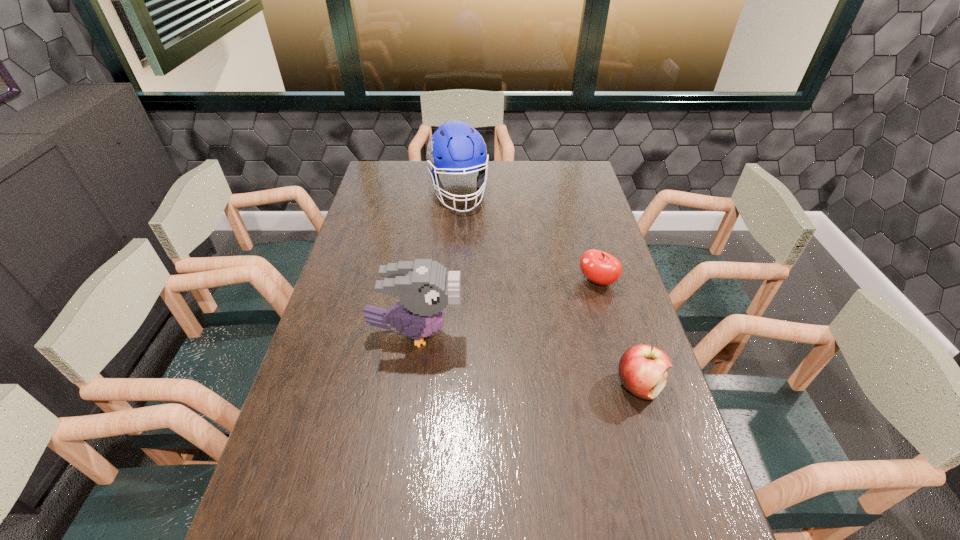
This screenshot has width=960, height=540. I want to click on bird, so click(x=424, y=287).

This screenshot has width=960, height=540. I want to click on the second nearest object, so click(424, 287).

Identify the location of the nearest object. (642, 369).

This screenshot has width=960, height=540. In order to click on the farthest object in this screenshot , I will do `click(455, 147)`.

Image resolution: width=960 pixels, height=540 pixels. In order to click on the second farthest object in this screenshot , I will do `click(599, 267)`.

Where is `vacant region located 0.050m at the beak of the third farthest object`? Image resolution: width=960 pixels, height=540 pixels. vacant region located 0.050m at the beak of the third farthest object is located at coordinates (479, 333).

Where is `vacant region located 0.080m on the bitten side of the nearest object`? This screenshot has width=960, height=540. vacant region located 0.080m on the bitten side of the nearest object is located at coordinates (656, 438).

Identify the location of vacant space situated 0.290m on the face guard of the farthest object. The height and width of the screenshot is (540, 960). (479, 265).

The height and width of the screenshot is (540, 960). I want to click on free location located 0.270m on the face guard of the farthest object, so click(x=478, y=261).

The image size is (960, 540). In order to click on blank space located 0.160m on the face guard of the farthest object in this screenshot , I will do `click(471, 241)`.